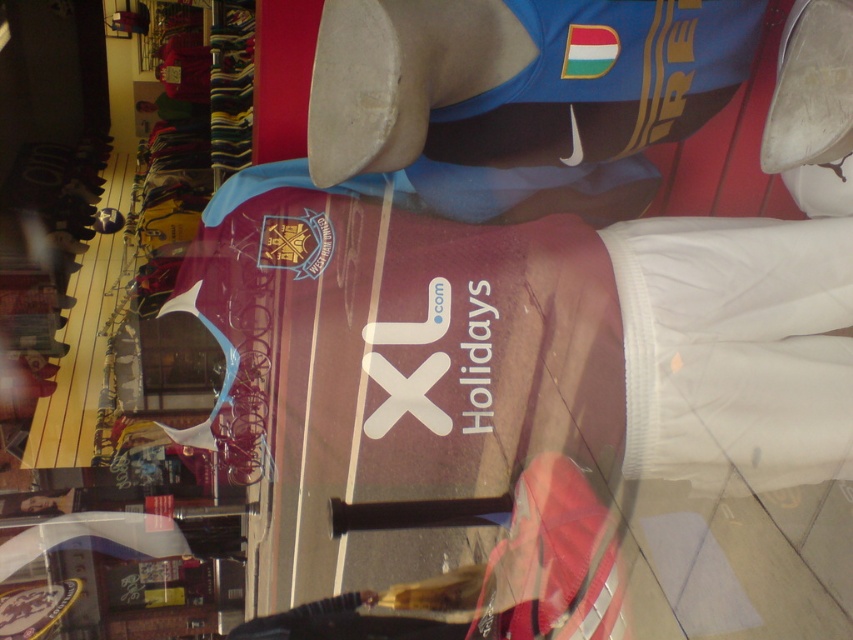
Question: Which point is farther from the camera taking this photo?

Choices:
 (A) (347, 49)
 (B) (761, 152)

Answer: (B)

Question: Can you confirm if white matte shoe at center is positioned to the right of white matte shoe at upper center?

Choices:
 (A) no
 (B) yes

Answer: (A)

Question: Is white matte shoe at center smaller than white matte shoe at upper center?

Choices:
 (A) yes
 (B) no

Answer: (A)

Question: Which object is farther from the camera taking this photo?

Choices:
 (A) white matte shoe at upper center
 (B) white matte shoe at center

Answer: (A)

Question: Does white matte shoe at center appear on the right side of white matte shoe at upper center?

Choices:
 (A) no
 (B) yes

Answer: (A)

Question: Among these points, which one is farthest from the camera?

Choices:
 (A) (335, 42)
 (B) (786, 145)

Answer: (B)